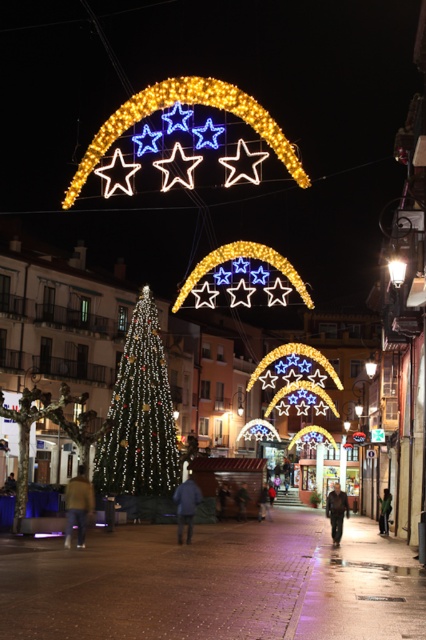
Between point (68, 488) and point (382, 509), which one is positioned in front?

Positioned in front is point (68, 488).

Who is positioned more to the right, brown fuzzy jacket at lower left or green fabric jacket at center?

green fabric jacket at center is more to the right.

The width and height of the screenshot is (426, 640). Describe the element at coordinates (77, 506) in the screenshot. I see `brown fuzzy jacket at lower left` at that location.

The height and width of the screenshot is (640, 426). I want to click on brown fuzzy jacket at lower left, so click(x=77, y=506).

Who is taller, illuminated glass christmas tree at center or illuminated wireframe star at upper center?

Standing taller between the two is illuminated wireframe star at upper center.

Between illuminated glass christmas tree at center and illuminated wireframe star at upper center, which one appears on the right side from the viewer's perspective?

From the viewer's perspective, illuminated glass christmas tree at center appears more on the right side.

Where is `illuminated glass christmas tree at center`? illuminated glass christmas tree at center is located at coordinates (140, 416).

Who is higher up, illuminated wireframe star at upper center or brown fuzzy jacket at lower left?

illuminated wireframe star at upper center is higher up.

In order to click on illuminated wireframe star at upper center in this screenshot , I will do `click(186, 102)`.